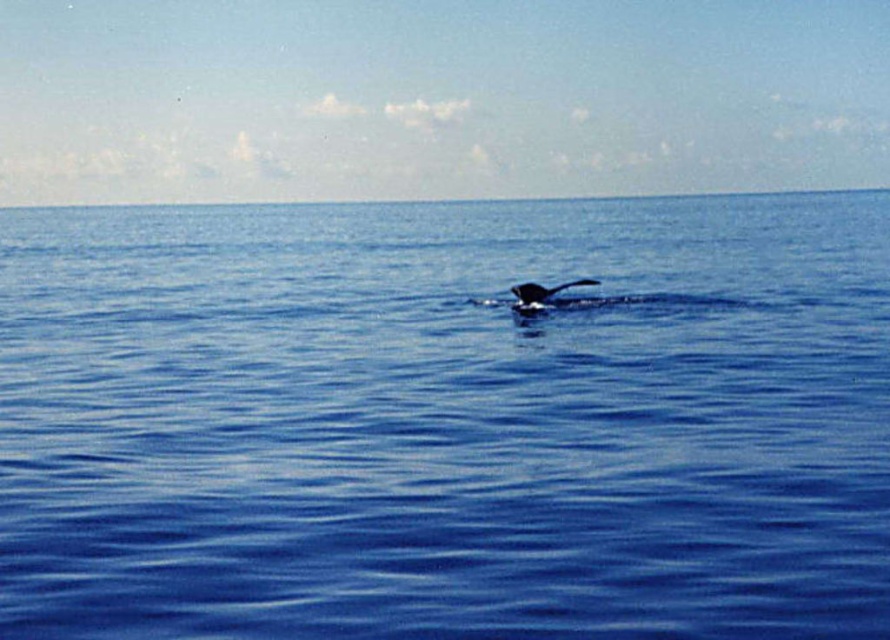
Can you confirm if blue water at center is smaller than gray matte whale at center?

Actually, blue water at center might be larger than gray matte whale at center.

Find the location of a particular element. blue water at center is located at coordinates (445, 420).

The height and width of the screenshot is (640, 890). What do you see at coordinates (445, 420) in the screenshot? I see `blue water at center` at bounding box center [445, 420].

Where is `blue water at center`? The width and height of the screenshot is (890, 640). blue water at center is located at coordinates (445, 420).